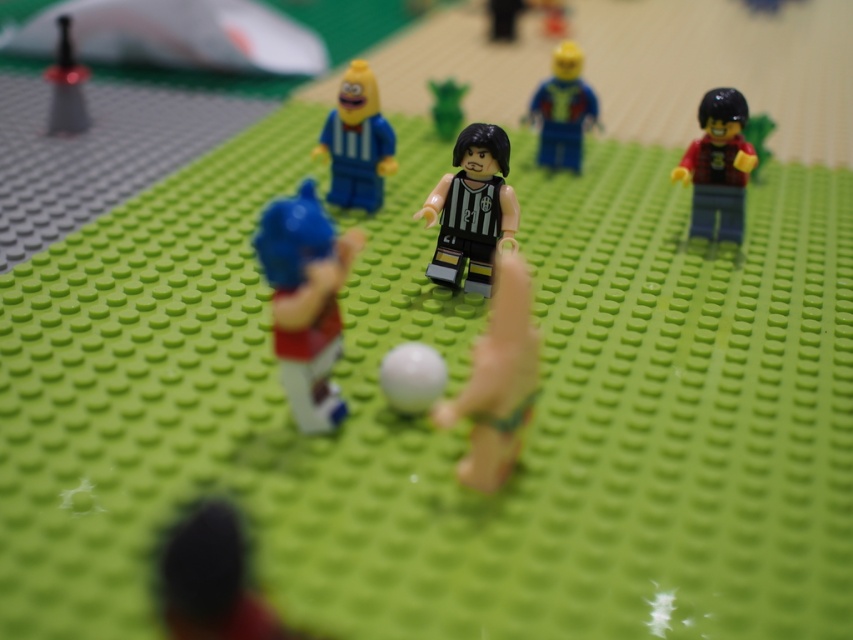
Question: Is matte red figure at center-left positioned behind smooth black figure at lower left?

Choices:
 (A) no
 (B) yes

Answer: (B)

Question: Which of the following is the closest to the observer?

Choices:
 (A) smooth black figure at lower left
 (B) shiny black pen at upper left
 (C) black matte figure at center
 (D) matte red figure at center-left

Answer: (A)

Question: Which of the following is the farthest from the observer?

Choices:
 (A) (187, 616)
 (B) (583, 118)
 (C) (729, 140)
 (D) (486, 236)

Answer: (B)

Question: Which object is closer to the camera taking this photo?

Choices:
 (A) shiny blue figure at upper center
 (B) shiny black pen at upper left

Answer: (A)

Question: Can you confirm if smooth black figure at lower left is positioned below shiny black pen at upper left?

Choices:
 (A) no
 (B) yes

Answer: (B)

Question: Can you confirm if matte red figure at center-left is positioned below green matte plant at center?

Choices:
 (A) no
 (B) yes

Answer: (B)